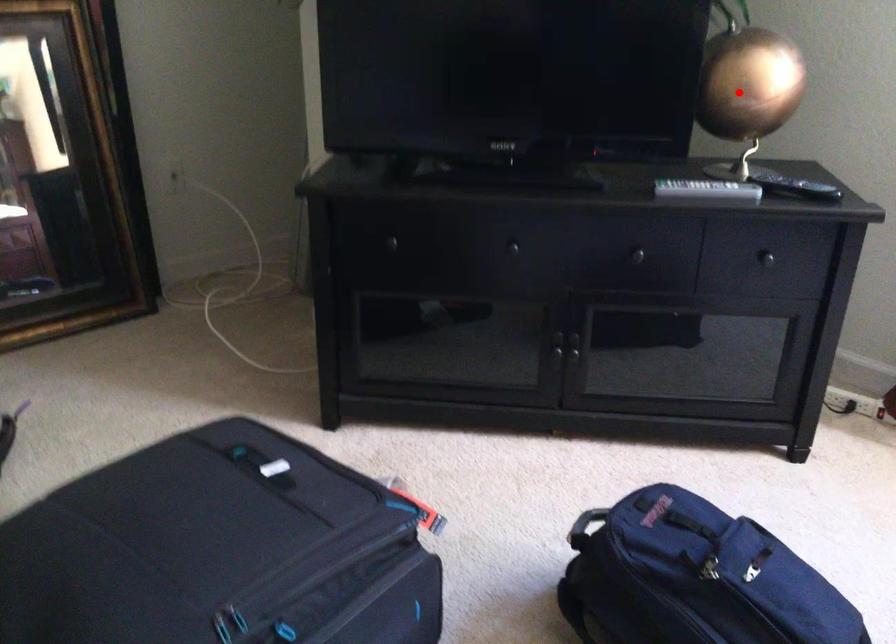
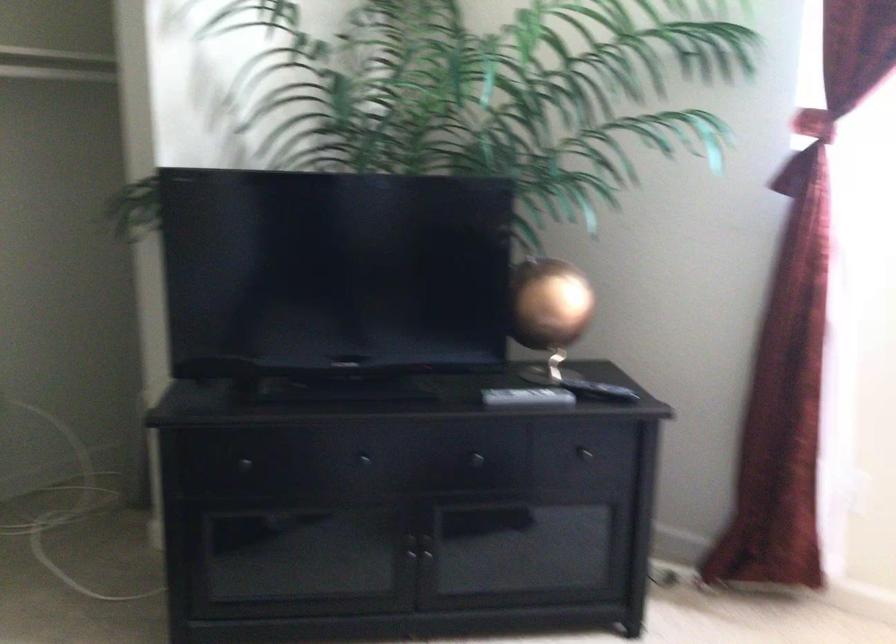
Question: I am providing you with two images of the same scene from different viewpoints. In image1, a red point is highlighted. Considering the same 3D point in image2, which of the following is correct?

Choices:
 (A) It is closer
 (B) It is farther

Answer: (B)